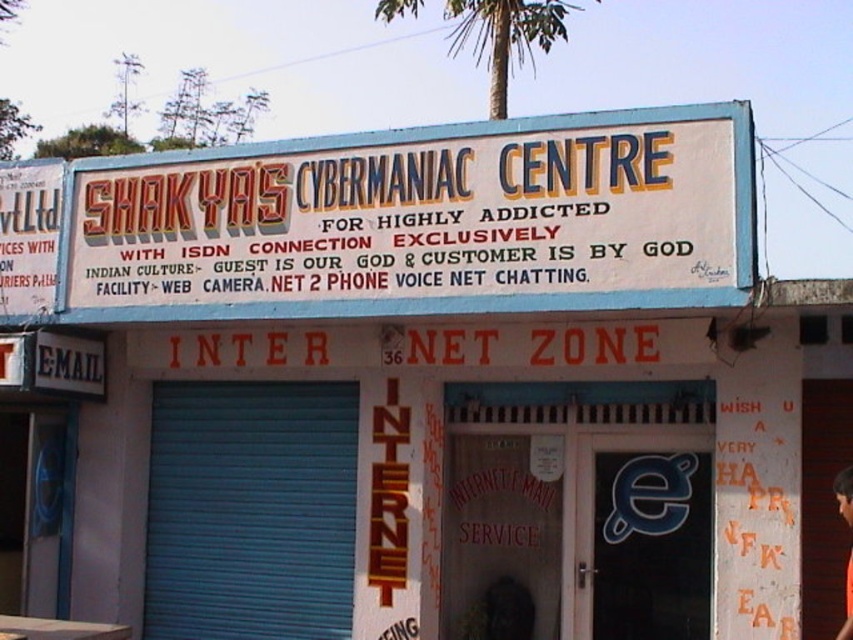
You are a customer entering the cyber cafe and see the green leafy palm tree at upper center and the orange fabric shirt at center. Which object is located higher up in the image?

The green leafy palm tree at upper center is positioned over the orange fabric shirt at center, so it is higher up in the image.

You are a customer entering the cyber cafe and see the white painted signboard at upper center and the orange fabric shirt at center. Which object is wider?

The white painted signboard at upper center is wider than the orange fabric shirt at center.